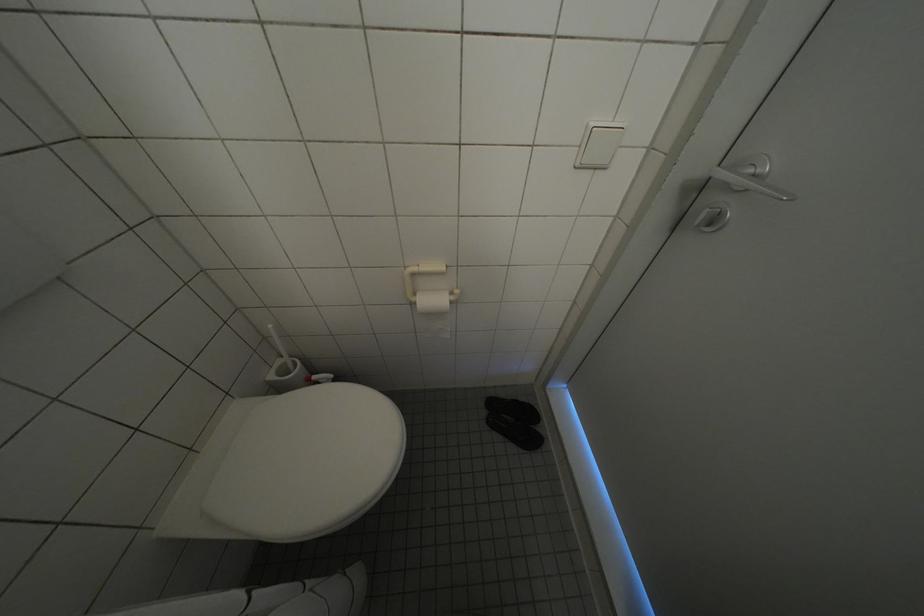
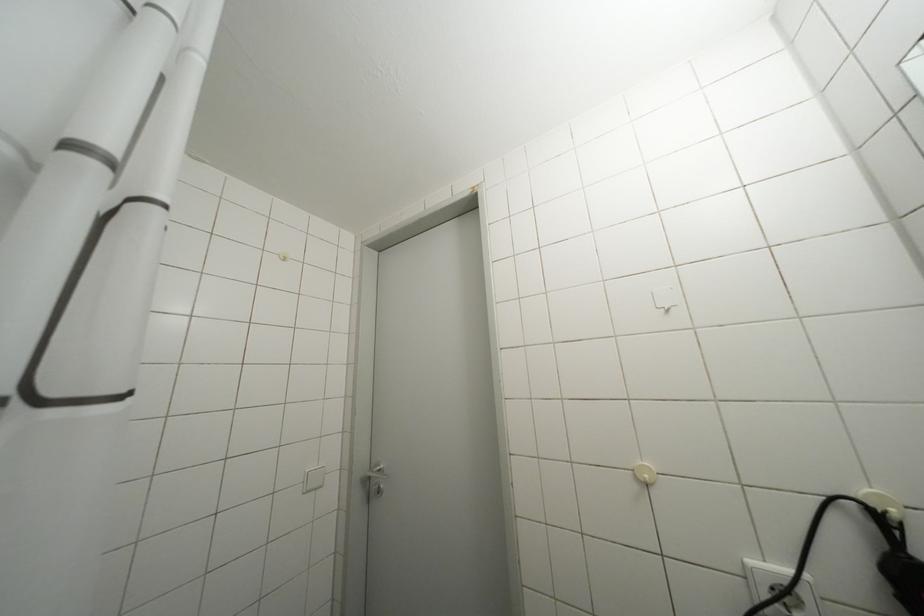
First-person continuous shooting, in which direction is the camera rotating?

The camera rotated toward right-up.